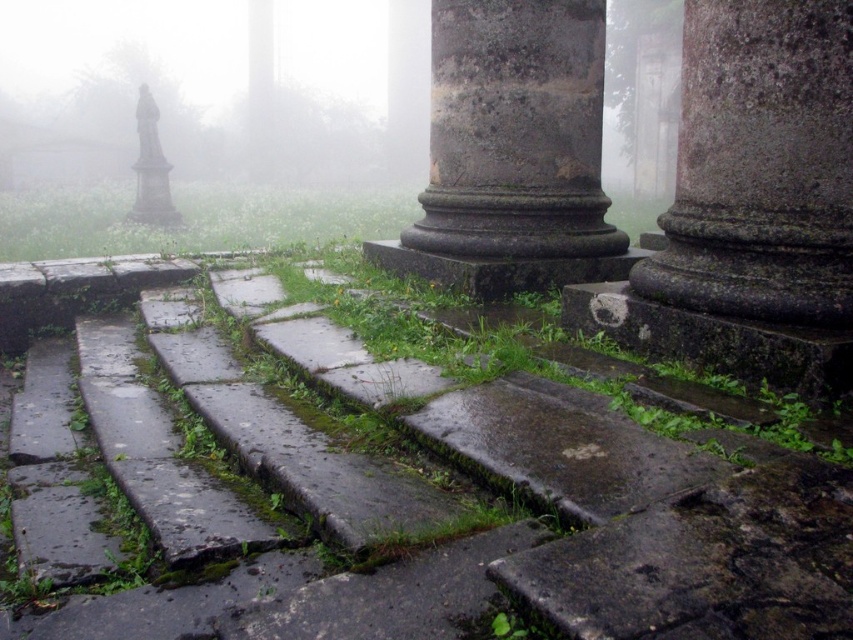
Question: Does dark gray stone column at center appear on the left side of stone statue at left?

Choices:
 (A) yes
 (B) no

Answer: (B)

Question: Which object appears farthest from the camera in this image?

Choices:
 (A) stone statue at left
 (B) dark gray stone column at center

Answer: (A)

Question: Is mossy stone steps at lower center in front of rough stone pillar at center?

Choices:
 (A) no
 (B) yes

Answer: (B)

Question: Which of the following is the farthest from the observer?

Choices:
 (A) (628, 420)
 (B) (142, 99)
 (C) (546, 93)

Answer: (B)

Question: Does mossy stone steps at lower center come in front of dark gray stone column at center?

Choices:
 (A) no
 (B) yes

Answer: (B)

Question: Which point is closer to the camera?

Choices:
 (A) mossy stone steps at lower center
 (B) dark gray stone column at center
 (C) stone statue at left
 (D) rough stone pillar at center

Answer: (A)